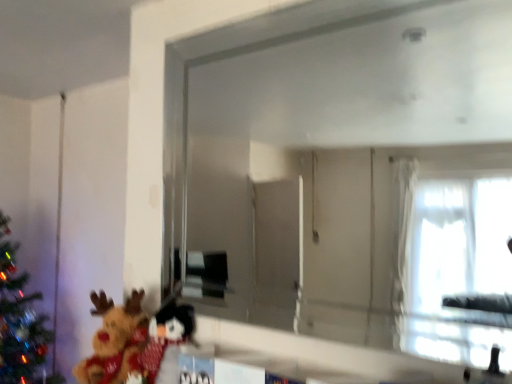
The width and height of the screenshot is (512, 384). I want to click on fluffy plush at lower left, so click(114, 339).

The width and height of the screenshot is (512, 384). Describe the element at coordinates (114, 339) in the screenshot. I see `fluffy plush at lower left` at that location.

In order to face fluffy plush at lower left, should I rotate leftwards or rightwards?

It's best to rotate left around 18.623 degrees.

Describe the element at coordinates (349, 173) in the screenshot. I see `clear glass mirror at center` at that location.

The height and width of the screenshot is (384, 512). Find the location of `clear glass mirror at center`. clear glass mirror at center is located at coordinates (349, 173).

Identify the location of fluffy plush at lower left. (114, 339).

Would you say fluffy plush at lower left is to the left or to the right of clear glass mirror at center in the picture?

In the image, fluffy plush at lower left appears on the left side of clear glass mirror at center.

Looking at this image, between fluffy plush at lower left and clear glass mirror at center, which one is positioned behind?

fluffy plush at lower left is more distant.

Is point (93, 381) in front of point (413, 11)?

No, it is behind (413, 11).

From the image's perspective, relative to clear glass mirror at center, is fluffy plush at lower left above or below?

Based on their image positions, fluffy plush at lower left is located beneath clear glass mirror at center.

From a real-world perspective, is fluffy plush at lower left located higher than clear glass mirror at center?

No.

Can you confirm if fluffy plush at lower left is wider than clear glass mirror at center?

Correct, the width of fluffy plush at lower left exceeds that of clear glass mirror at center.

Which of these two, fluffy plush at lower left or clear glass mirror at center, stands taller?

Answer: clear glass mirror at center is taller.

Is fluffy plush at lower left smaller than clear glass mirror at center?

Yes.

Is fluffy plush at lower left inside the boundaries of clear glass mirror at center, or outside?

fluffy plush at lower left is outside clear glass mirror at center.

In the scene shown: Is fluffy plush at lower left touching clear glass mirror at center?

No, fluffy plush at lower left is not beside clear glass mirror at center.

Is fluffy plush at lower left facing towards clear glass mirror at center?

No, fluffy plush at lower left is not turned towards clear glass mirror at center.

Measure the distance between fluffy plush at lower left and clear glass mirror at center.

20.74 inches.

The height and width of the screenshot is (384, 512). I want to click on toy that is on the left side of clear glass mirror at center, so click(114, 339).

Considering the relative positions of clear glass mirror at center and fluffy plush at lower left in the image provided, is clear glass mirror at center to the left of fluffy plush at lower left from the viewer's perspective?

Incorrect, clear glass mirror at center is not on the left side of fluffy plush at lower left.

Which is in front, clear glass mirror at center or fluffy plush at lower left?

clear glass mirror at center is closer to the camera.

Considering the positions of point (462, 48) and point (100, 303), is point (462, 48) closer or farther from the camera than point (100, 303)?

Point (462, 48) is positioned closer to the camera compared to point (100, 303).

From the image's perspective, which one is positioned lower, clear glass mirror at center or fluffy plush at lower left?

From the image's view, fluffy plush at lower left is below.

From a real-world perspective, relative to fluffy plush at lower left, is clear glass mirror at center vertically above or below?

clear glass mirror at center is situated higher than fluffy plush at lower left in the real world.

Between clear glass mirror at center and fluffy plush at lower left, which one has larger width?

fluffy plush at lower left.

From their relative heights in the image, would you say clear glass mirror at center is taller or shorter than fluffy plush at lower left?

Considering their sizes, clear glass mirror at center has more height than fluffy plush at lower left.

Who is bigger, clear glass mirror at center or fluffy plush at lower left?

clear glass mirror at center is bigger.

Would you say clear glass mirror at center is outside fluffy plush at lower left?

Yes, clear glass mirror at center is not within fluffy plush at lower left.

Is clear glass mirror at center far away from fluffy plush at lower left?

clear glass mirror at center is actually quite close to fluffy plush at lower left.

Is clear glass mirror at center oriented away from fluffy plush at lower left?

clear glass mirror at center is not turned away from fluffy plush at lower left.

Can you tell me how much clear glass mirror at center and fluffy plush at lower left differ in facing direction?

The angle between the facing direction of clear glass mirror at center and the facing direction of fluffy plush at lower left is 5.81 degrees.

Measure the distance between clear glass mirror at center and fluffy plush at lower left.

clear glass mirror at center and fluffy plush at lower left are 20.74 inches apart from each other.

In the image, there is a fluffy plush at lower left. Where is `mirror above it (from the image's perspective)`? mirror above it (from the image's perspective) is located at coordinates (349, 173).

Image resolution: width=512 pixels, height=384 pixels. Identify the location of mirror on the right of fluffy plush at lower left. (349, 173).

You are a GUI agent. You are given a task and a screenshot of the screen. Output one action in this format:
    pyautogui.click(x=<x>, y=<y>)
    Task: Click on the toy behind the clear glass mirror at center
    The height and width of the screenshot is (384, 512).
    Given the screenshot: What is the action you would take?
    pyautogui.click(x=114, y=339)